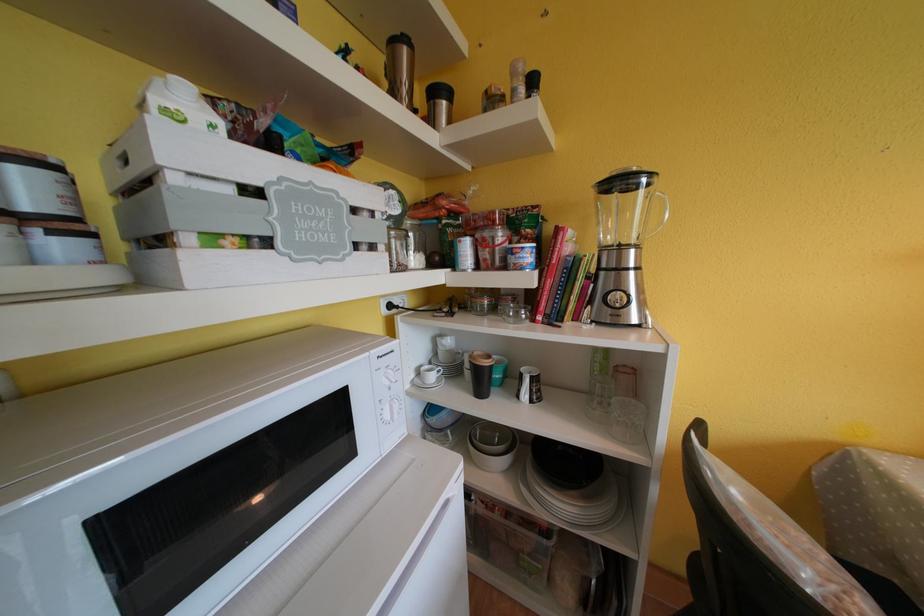
This screenshot has height=616, width=924. Describe the element at coordinates (636, 302) in the screenshot. I see `the blender control knob` at that location.